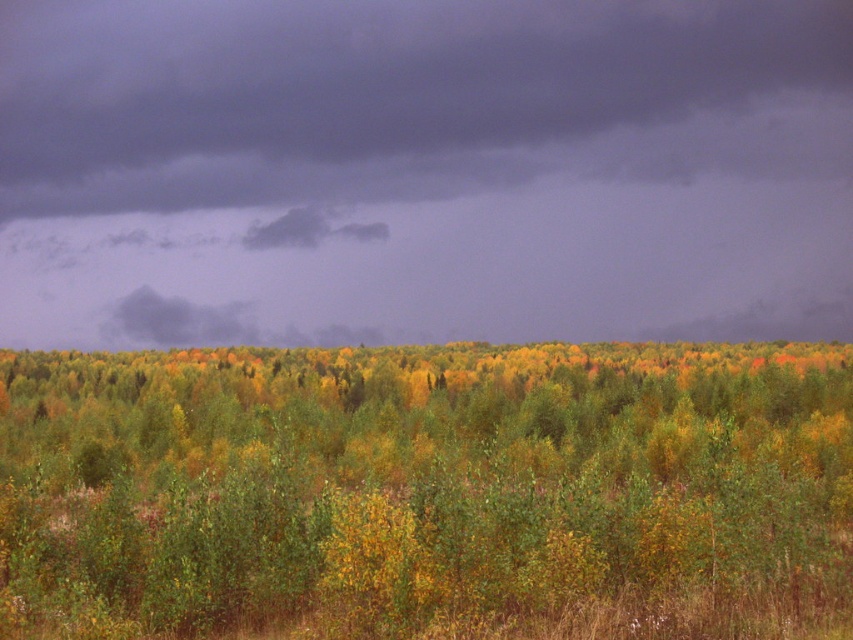
Can you confirm if dark gray cloud at upper center is smaller than green leafy forest at center?

No, dark gray cloud at upper center is not smaller than green leafy forest at center.

Which of these two, dark gray cloud at upper center or green leafy forest at center, stands shorter?

With less height is green leafy forest at center.

The height and width of the screenshot is (640, 853). What do you see at coordinates (422, 170) in the screenshot?
I see `dark gray cloud at upper center` at bounding box center [422, 170].

Identify the location of dark gray cloud at upper center. (422, 170).